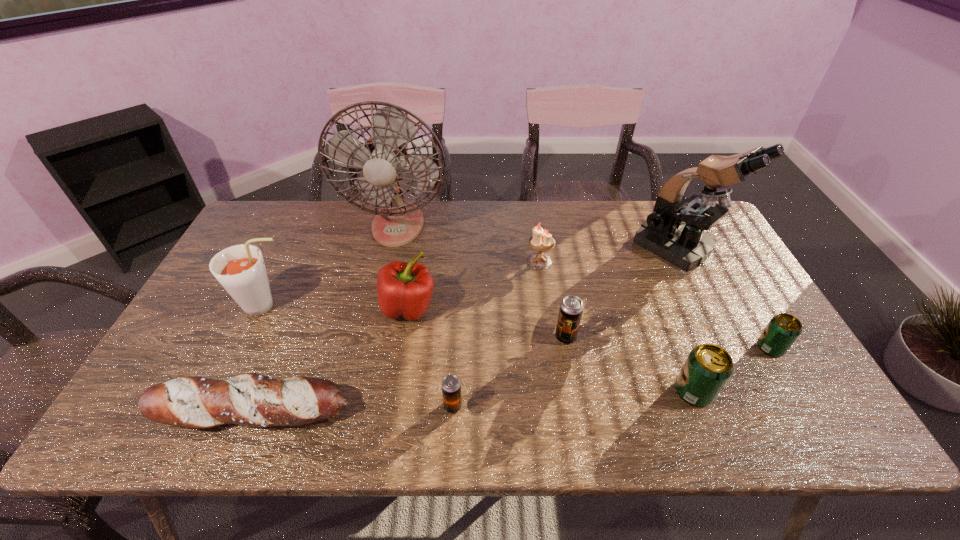
Identify the location of beer can present at the right edge. (783, 329).

Where is `object that is at the near left corner`? The width and height of the screenshot is (960, 540). object that is at the near left corner is located at coordinates tap(250, 399).

The width and height of the screenshot is (960, 540). In order to click on object located at the far right corner in this screenshot , I will do `click(674, 230)`.

In the image, there is a desktop. Where is `vacant space at the far edge`? vacant space at the far edge is located at coordinates (514, 201).

Locate an element on the screen. This screenshot has width=960, height=540. vacant area at the near edge of the desktop is located at coordinates (583, 430).

Locate an element on the screen. Image resolution: width=960 pixels, height=540 pixels. free space at the left edge of the desktop is located at coordinates (228, 309).

The height and width of the screenshot is (540, 960). Identify the location of free region at the near right corner. (833, 418).

Where is `vacant space that's between the farther black beer can and the microscope`? vacant space that's between the farther black beer can and the microscope is located at coordinates (621, 293).

This screenshot has width=960, height=540. Identify the location of vacant region between the microscope and the third tallest object. (471, 277).

The image size is (960, 540). I want to click on free space between the third beer can from right to left and the fan, so click(482, 281).